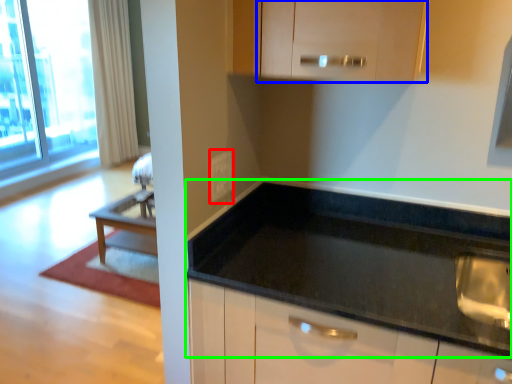
Question: Considering the real-world distances, which object is farthest from electric outlet (highlighted by a red box)? cabinetry (highlighted by a blue box) or countertop (highlighted by a green box)?

Choices:
 (A) cabinetry
 (B) countertop

Answer: (A)